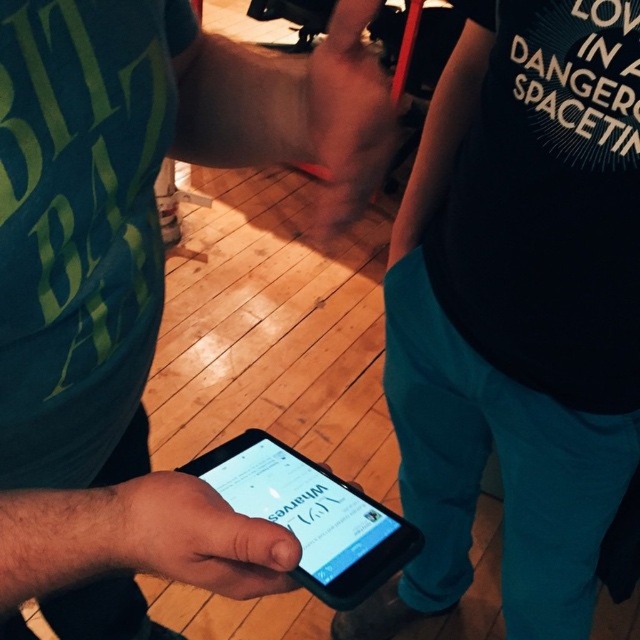
Question: Which point is closer to the camera taking this photo?

Choices:
 (A) (x=164, y=528)
 (B) (x=362, y=182)

Answer: (A)

Question: Which object is positioned closest to the black matte shirt at center?

Choices:
 (A) matte black phone at lower center
 (B) black matte smartphone at lower center
 (C) black matte phone at center
 (D) matte skin hand at center

Answer: (A)

Question: Does black matte shirt at center appear on the left side of black matte phone at center?

Choices:
 (A) yes
 (B) no

Answer: (B)

Question: Can you confirm if black matte shirt at center is bigger than black matte phone at center?

Choices:
 (A) no
 (B) yes

Answer: (B)

Question: Which point is closer to the camera?

Choices:
 (A) coord(252,436)
 (B) coord(51,100)
 (C) coord(180,508)
 (D) coord(396,339)

Answer: (C)

Question: Does black matte smartphone at lower center have a smaller size compared to matte skin hand at center?

Choices:
 (A) no
 (B) yes

Answer: (A)